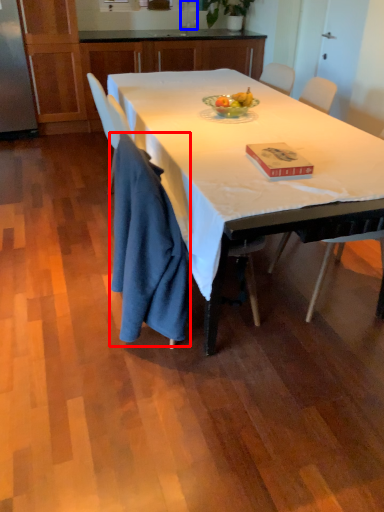
Question: Which of the following is the closest to the observer, cloth (highlighted by a red box) or sink (highlighted by a blue box)?

Choices:
 (A) cloth
 (B) sink

Answer: (A)